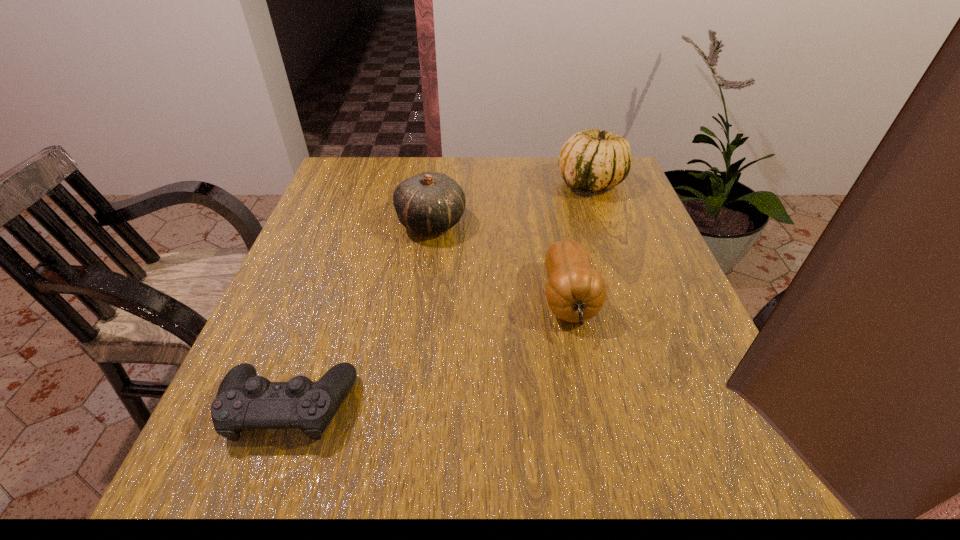
Where is `object that is positioned at the left edge`? object that is positioned at the left edge is located at coordinates (244, 400).

Where is `object located in the right edge section of the desktop`? object located in the right edge section of the desktop is located at coordinates (591, 160).

You are a GUI agent. You are given a task and a screenshot of the screen. Output one action in this format:
    pyautogui.click(x=<x>, y=<y>)
    Task: Click on the object situated at the far right corner
    The height and width of the screenshot is (540, 960).
    Given the screenshot: What is the action you would take?
    pos(591,160)

You are a GUI agent. You are given a task and a screenshot of the screen. Output one action in this format:
    pyautogui.click(x=<x>, y=<y>)
    Task: Click on the vacant space at the far edge of the desktop
    This screenshot has height=540, width=960.
    Given the screenshot: What is the action you would take?
    pyautogui.click(x=558, y=185)

At what (x,y) coordinates should I click in order to perform the action: click on free space at the near edge. Please return your answer as a coordinate pair (x, y). Looking at the image, I should click on (404, 465).

Where is `vacant region at the left edge of the desktop`? This screenshot has height=540, width=960. vacant region at the left edge of the desktop is located at coordinates (300, 246).

At what (x,y) coordinates should I click in order to perform the action: click on vacant region at the right edge. Please return your answer as a coordinate pair (x, y). This screenshot has height=540, width=960. Looking at the image, I should click on (612, 213).

Locate an element on the screen. The width and height of the screenshot is (960, 540). vacant area at the far left corner of the desktop is located at coordinates (x=334, y=179).

Find the location of a particular element. The image size is (960, 540). vacant region at the near left corner of the desktop is located at coordinates (255, 516).

This screenshot has width=960, height=540. Find the location of `vacant space at the far right corner of the desktop`. vacant space at the far right corner of the desktop is located at coordinates (603, 192).